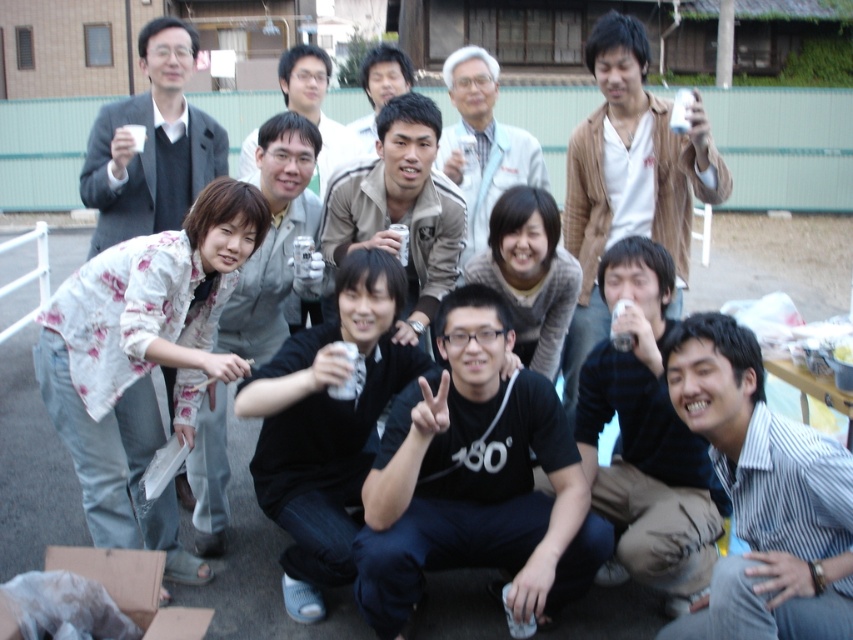
Question: Which object is farther from the camera taking this photo?

Choices:
 (A) dark blue sweater at center
 (B) brown leather jacket at upper center
 (C) striped shirt at center
 (D) black matte t-shirt at center

Answer: (B)

Question: Which point is closer to the camera?

Choices:
 (A) matte black shirt at center
 (B) striped shirt at center

Answer: (B)

Question: Is dark blue sweater at center to the left of matte gray suit at left from the viewer's perspective?

Choices:
 (A) no
 (B) yes

Answer: (A)

Question: Can you confirm if dark blue sweater at center is positioned above matte gray suit at left?

Choices:
 (A) yes
 (B) no

Answer: (B)

Question: Which object is the closest to the black matte t-shirt at center?

Choices:
 (A) brown leather jacket at upper center
 (B) striped shirt at center
 (C) matte black shirt at center
 (D) matte gray suit at left

Answer: (B)

Question: Does striped shirt at center lie in front of light blue fabric shirt at center?

Choices:
 (A) no
 (B) yes

Answer: (B)